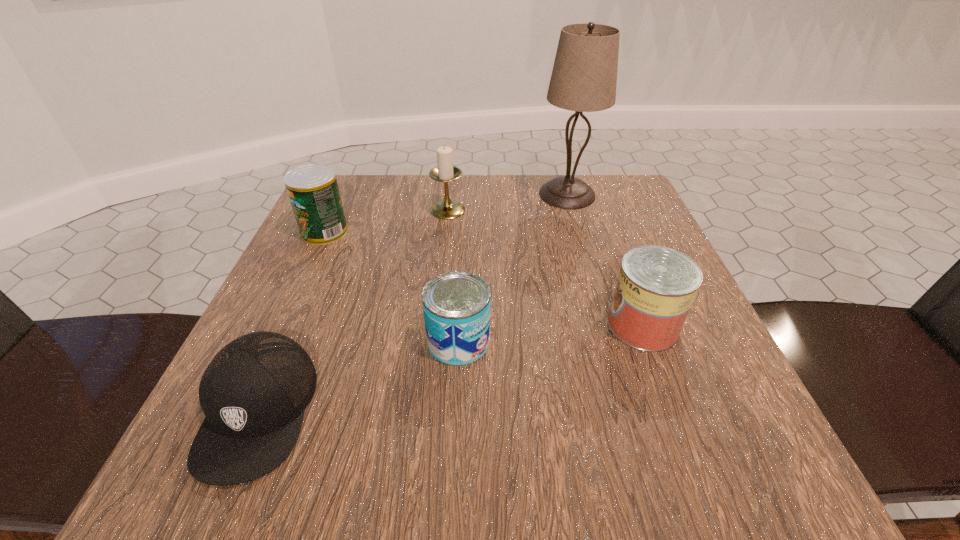
Image resolution: width=960 pixels, height=540 pixels. I want to click on object that is at the near left corner, so click(253, 393).

You are a GUI agent. You are given a task and a screenshot of the screen. Output one action in this format:
    pyautogui.click(x=<x>, y=<y>)
    Task: Click on the object that is positioned at the far right corner
    The image size is (960, 540).
    Given the screenshot: What is the action you would take?
    pyautogui.click(x=584, y=77)

This screenshot has height=540, width=960. I want to click on free space at the far edge of the desktop, so click(x=457, y=228).

Where is `vacant space at the near edge of the desktop`? vacant space at the near edge of the desktop is located at coordinates (581, 453).

Locate an element on the screen. free region at the left edge of the desktop is located at coordinates (366, 242).

You are a GUI agent. You are given a task and a screenshot of the screen. Output one action in this format:
    pyautogui.click(x=<x>, y=<y>)
    Task: Click on the vacant space at the right edge
    
    Given the screenshot: What is the action you would take?
    pyautogui.click(x=652, y=404)

Where is `free location at the far right corner of the desktop`? Image resolution: width=960 pixels, height=540 pixels. free location at the far right corner of the desktop is located at coordinates (593, 230).

The image size is (960, 540). Find the location of `free region at the near right corner of the desktop`. free region at the near right corner of the desktop is located at coordinates (740, 430).

Identify the location of vacant area that lies between the shortest can and the lampshade. This screenshot has width=960, height=540. (x=513, y=268).

Identify the location of vacant area that lies between the tallest object and the rightmost can. (605, 260).